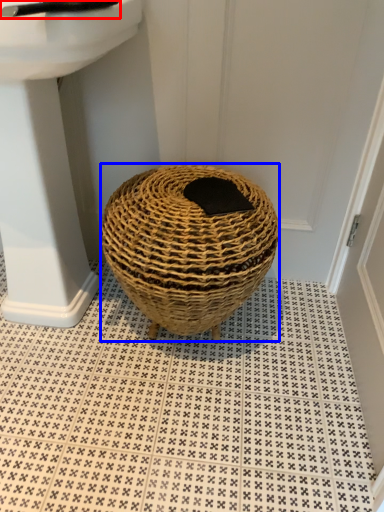
Question: Among these objects, which one is nearest to the camera, faucet (highlighted by a red box) or basket (highlighted by a blue box)?

Choices:
 (A) faucet
 (B) basket

Answer: (A)